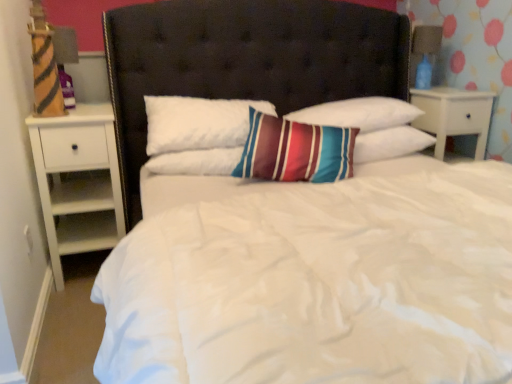
Question: Which direction should I rotate to look at striped fabric pillow at center, which appears as the second pillow when viewed from the left?

Choices:
 (A) right
 (B) left

Answer: (A)

Question: Is striped fabric pillow at center, the second pillow from the right, shorter than striped cotton pillow at center, the first pillow viewed from the right?

Choices:
 (A) no
 (B) yes

Answer: (A)

Question: Is striped fabric pillow at center, which appears as the second pillow when viewed from the left, oriented away from striped cotton pillow at center, the third pillow when ordered from left to right?

Choices:
 (A) no
 (B) yes

Answer: (A)

Question: From a real-world perspective, is striped fabric pillow at center, which appears as the second pillow when viewed from the left, positioned over striped cotton pillow at center, the third pillow when ordered from left to right, based on gravity?

Choices:
 (A) yes
 (B) no

Answer: (A)

Question: Considering the relative positions of striped fabric pillow at center, which appears as the second pillow when viewed from the left, and striped cotton pillow at center, the first pillow viewed from the right, in the image provided, is striped fabric pillow at center, which appears as the second pillow when viewed from the left, to the left of striped cotton pillow at center, the first pillow viewed from the right, from the viewer's perspective?

Choices:
 (A) yes
 (B) no

Answer: (A)

Question: Does striped fabric pillow at center, the second pillow from the right, have a lesser width compared to striped cotton pillow at center, the first pillow viewed from the right?

Choices:
 (A) yes
 (B) no

Answer: (A)

Question: Does striped fabric pillow at center, which appears as the second pillow when viewed from the left, lie behind striped cotton pillow at center, the third pillow when ordered from left to right?

Choices:
 (A) no
 (B) yes

Answer: (A)

Question: Considering the relative sizes of blue glass lamp at upper right and white wood nightstand at right, which is counted as the 1th nightstand, starting from the right, in the image provided, is blue glass lamp at upper right bigger than white wood nightstand at right, which is counted as the 1th nightstand, starting from the right,?

Choices:
 (A) yes
 (B) no

Answer: (B)

Question: Is the depth of blue glass lamp at upper right less than that of white wood nightstand at right, which is counted as the 1th nightstand, starting from the right?

Choices:
 (A) no
 (B) yes

Answer: (A)

Question: Is blue glass lamp at upper right touching white wood nightstand at right, which appears as the 2th nightstand when viewed from the left?

Choices:
 (A) yes
 (B) no

Answer: (B)

Question: From the image's perspective, is blue glass lamp at upper right over white wood nightstand at right, which is counted as the 1th nightstand, starting from the right?

Choices:
 (A) yes
 (B) no

Answer: (A)

Question: Are blue glass lamp at upper right and white wood nightstand at right, which is counted as the 1th nightstand, starting from the right, located far from each other?

Choices:
 (A) yes
 (B) no

Answer: (B)

Question: From a real-world perspective, is blue glass lamp at upper right on white wood nightstand at right, which is counted as the 1th nightstand, starting from the right?

Choices:
 (A) no
 (B) yes

Answer: (B)

Question: Can you confirm if white soft pillow at center, which appears as the 3th pillow when viewed from the right, is wider than blue glass lamp at upper right?

Choices:
 (A) no
 (B) yes

Answer: (B)